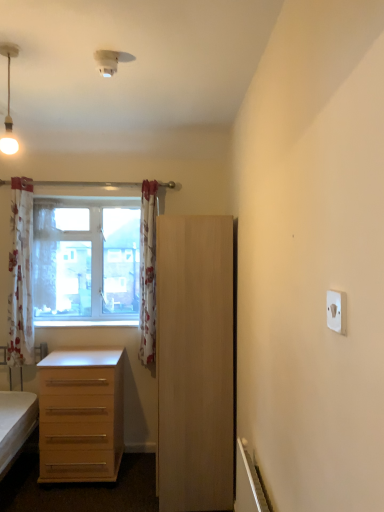
In the scene shown: Measure the distance between light wood cabinet at center and camera.

A distance of 8.11 feet exists between light wood cabinet at center and camera.

The width and height of the screenshot is (384, 512). What do you see at coordinates (44, 258) in the screenshot?
I see `white floral curtain at window, the second curtain when ordered from right to left` at bounding box center [44, 258].

At what (x,y) coordinates should I click in order to perform the action: click on white glossy window sill at lower center. Please return your answer as a coordinate pair (x, y). This screenshot has width=384, height=512. Looking at the image, I should click on (87, 323).

Image resolution: width=384 pixels, height=512 pixels. What do you see at coordinates (87, 323) in the screenshot?
I see `white glossy window sill at lower center` at bounding box center [87, 323].

Image resolution: width=384 pixels, height=512 pixels. I want to click on matte white pendant light at upper left, so point(8,102).

Find the location of a particular element. This screenshot has height=512, width=384. white floral fabric curtain at left, which is counted as the first curtain, starting from the left is located at coordinates (21, 275).

I want to click on lamp above the white plastic radiator at lower right (from a real-world perspective), so click(x=8, y=102).

Looking at this image, which of these two, white plastic radiator at lower right or matte white pendant light at upper left, is wider?

matte white pendant light at upper left.

What's the angular difference between white plastic radiator at lower right and matte white pendant light at upper left's facing directions?

The angle between the facing direction of white plastic radiator at lower right and the facing direction of matte white pendant light at upper left is 90.7 degrees.

Considering the points (238, 479) and (12, 137), which point is in front, point (238, 479) or point (12, 137)?

Point (238, 479)

From the image's perspective, between clear glass window at upper left and white floral curtain at window, which is the second curtain from left to right, who is located below?

clear glass window at upper left appears lower in the image.

Can you tell me how much clear glass window at upper left and white floral curtain at window, which is the second curtain from left to right, differ in facing direction?

1.24 degrees separate the facing orientations of clear glass window at upper left and white floral curtain at window, which is the second curtain from left to right.

Is clear glass window at upper left next to white floral curtain at window, which is the second curtain from left to right, and touching it?

clear glass window at upper left and white floral curtain at window, which is the second curtain from left to right, are clearly separated.

Which of these two, clear glass window at upper left or white floral curtain at window, which is the second curtain from left to right, stands taller?

Standing taller between the two is clear glass window at upper left.

Find the location of a particular element. The image size is (384, 512). curtain that is the 2nd object located below the matte white pendant light at upper left (from the image's perspective) is located at coordinates (21, 275).

Looking at this image, considering the relative sizes of matte white pendant light at upper left and white floral fabric curtain at left, which is counted as the first curtain, starting from the left, in the image provided, is matte white pendant light at upper left wider than white floral fabric curtain at left, which is counted as the first curtain, starting from the left,?

In fact, matte white pendant light at upper left might be narrower than white floral fabric curtain at left, which is counted as the first curtain, starting from the left.

Which is more to the left, matte white pendant light at upper left or white floral fabric curtain at left, which appears as the third curtain when viewed from the right?

white floral fabric curtain at left, which appears as the third curtain when viewed from the right, is more to the left.

From a real-world perspective, who is located higher, matte white pendant light at upper left or white floral fabric curtain at left, which appears as the third curtain when viewed from the right?

matte white pendant light at upper left is physically above.

Based on the photo, does floral fabric curtain at center, which appears as the first curtain when viewed from the right, lie in front of clear glass window at upper left?

Yes, floral fabric curtain at center, which appears as the first curtain when viewed from the right, is closer to the camera.

Are floral fabric curtain at center, which ranks as the 3th curtain in left-to-right order, and clear glass window at upper left far apart?

Actually, floral fabric curtain at center, which ranks as the 3th curtain in left-to-right order, and clear glass window at upper left are a little close together.

Can you confirm if floral fabric curtain at center, which ranks as the 3th curtain in left-to-right order, is wider than clear glass window at upper left?

Yes, floral fabric curtain at center, which ranks as the 3th curtain in left-to-right order, is wider than clear glass window at upper left.

Based on the photo, between floral fabric curtain at center, which ranks as the 3th curtain in left-to-right order, and clear glass window at upper left, which one has smaller size?

floral fabric curtain at center, which ranks as the 3th curtain in left-to-right order, is smaller.

From a real-world perspective, between light wood cabinet at center and light wood drawer at lower left, who is vertically lower?

In real-world perspective, light wood drawer at lower left is lower.

Is light wood cabinet at center far away from light wood drawer at lower left?

No, light wood cabinet at center is in close proximity to light wood drawer at lower left.

Considering the relative sizes of light wood cabinet at center and light wood drawer at lower left in the image provided, is light wood cabinet at center smaller than light wood drawer at lower left?

No, light wood cabinet at center is not smaller than light wood drawer at lower left.

From the image's perspective, is light wood cabinet at center positioned above or below light wood drawer at lower left?

Based on their image positions, light wood cabinet at center is located above light wood drawer at lower left.

Considering the positions of objects floral fabric curtain at center, which appears as the first curtain when viewed from the right, and white plastic electric outlet at upper right in the image provided, who is more to the left, floral fabric curtain at center, which appears as the first curtain when viewed from the right, or white plastic electric outlet at upper right?

floral fabric curtain at center, which appears as the first curtain when viewed from the right, is more to the left.

Is floral fabric curtain at center, which ranks as the 3th curtain in left-to-right order, completely or partially outside of white plastic electric outlet at upper right?

Yes, floral fabric curtain at center, which ranks as the 3th curtain in left-to-right order, is not within white plastic electric outlet at upper right.

Who is shorter, floral fabric curtain at center, which ranks as the 3th curtain in left-to-right order, or white plastic electric outlet at upper right?

white plastic electric outlet at upper right is shorter.

Based on the photo, from a real-world perspective, which object stands above the other?

white plastic radiator at lower right.

Does white plastic radiator at lower right turn towards light wood drawer at lower left?

No, white plastic radiator at lower right is not turned towards light wood drawer at lower left.

From the image's perspective, which one is positioned lower, white plastic radiator at lower right or light wood drawer at lower left?

light wood drawer at lower left.

Considering the relative sizes of white plastic radiator at lower right and light wood drawer at lower left in the image provided, is white plastic radiator at lower right taller than light wood drawer at lower left?

No, white plastic radiator at lower right is not taller than light wood drawer at lower left.

I want to click on radiator below the matte white pendant light at upper left (from a real-world perspective), so click(x=248, y=484).

This screenshot has height=512, width=384. Identify the location of the 1st curtain counting from the left side of the clear glass window at upper left. coord(44,258).

Estimate the real-world distances between objects in this image. Which object is further from matte white pendant light at upper left, light wood drawer at lower left or clear glass window at upper left?

light wood drawer at lower left.

Estimate the real-world distances between objects in this image. Which object is closer to white plastic radiator at lower right, white glossy window sill at lower center or white floral fabric curtain at left, which is counted as the first curtain, starting from the left?

white glossy window sill at lower center is closer to white plastic radiator at lower right.

Looking at this image, looking at the image, which one is located closer to clear glass window at upper left, white plastic electric outlet at upper right or matte white pendant light at upper left?

matte white pendant light at upper left is positioned closer to the anchor clear glass window at upper left.

Looking at the image, which one is located closer to white glossy window sill at lower center, white plastic electric outlet at upper right or white floral curtain at window, which is the second curtain from left to right?

Among the two, white floral curtain at window, which is the second curtain from left to right, is located nearer to white glossy window sill at lower center.

Considering their positions, is white plastic radiator at lower right positioned further to white floral curtain at window, the second curtain when ordered from right to left, than clear glass window at upper left?

white plastic radiator at lower right lies further to white floral curtain at window, the second curtain when ordered from right to left, than the other object.

From the image, which object appears to be farther from clear glass window at upper left, floral fabric curtain at center, which ranks as the 3th curtain in left-to-right order, or light wood drawer at lower left?

Based on the image, light wood drawer at lower left appears to be further to clear glass window at upper left.

Looking at the image, which one is located closer to light wood drawer at lower left, clear glass window at upper left or white floral curtain at window, the second curtain when ordered from right to left?

The object closer to light wood drawer at lower left is clear glass window at upper left.

Looking at the image, which one is located closer to light wood cabinet at center, light wood drawer at lower left or floral fabric curtain at center, which ranks as the 3th curtain in left-to-right order?

Among the two, floral fabric curtain at center, which ranks as the 3th curtain in left-to-right order, is located nearer to light wood cabinet at center.

At what (x,y) coordinates should I click in order to perform the action: click on window sill between matte white pendant light at upper left and clear glass window at upper left along the z-axis. Please return your answer as a coordinate pair (x, y). This screenshot has height=512, width=384. Looking at the image, I should click on (87, 323).

Identify the location of lamp located between white plastic electric outlet at upper right and white floral fabric curtain at left, which is counted as the first curtain, starting from the left, in the depth direction. The height and width of the screenshot is (512, 384). (8, 102).

The height and width of the screenshot is (512, 384). Find the location of `window sill between white floral curtain at window, which is the second curtain from left to right, and light wood drawer at lower left, in the vertical direction`. window sill between white floral curtain at window, which is the second curtain from left to right, and light wood drawer at lower left, in the vertical direction is located at coordinates 87,323.

The height and width of the screenshot is (512, 384). Find the location of `window sill located between white floral fabric curtain at left, which appears as the third curtain when viewed from the right, and floral fabric curtain at center, which appears as the first curtain when viewed from the right, in the left-right direction`. window sill located between white floral fabric curtain at left, which appears as the third curtain when viewed from the right, and floral fabric curtain at center, which appears as the first curtain when viewed from the right, in the left-right direction is located at coordinates tap(87, 323).